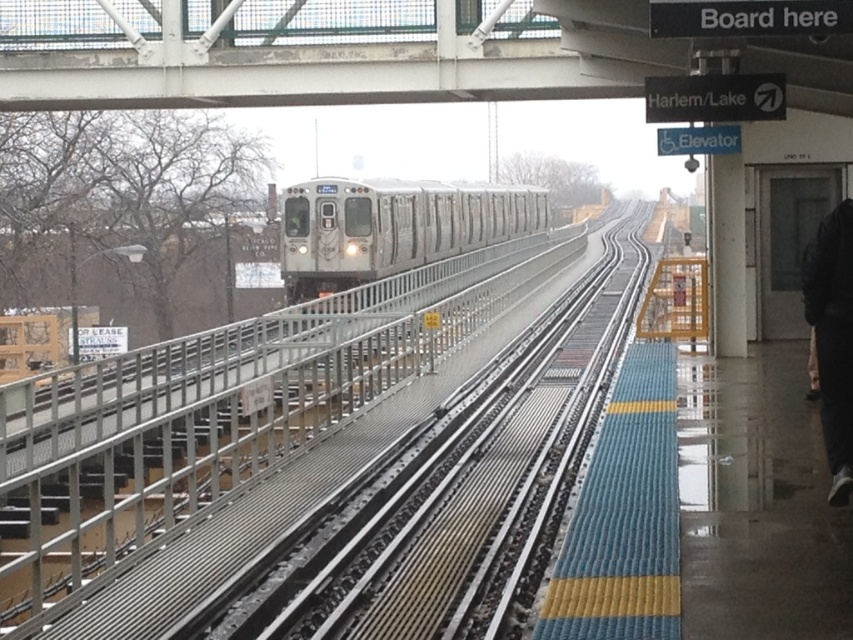
Is metal/smooth rail at center to the right of black fabric pants at lower right from the viewer's perspective?

No, metal/smooth rail at center is not to the right of black fabric pants at lower right.

Can you confirm if metal/smooth rail at center is positioned below black fabric pants at lower right?

No.

Between point (27, 609) and point (845, 460), which one is positioned in front?

Point (845, 460)

Where is `metal/smooth rail at center`? metal/smooth rail at center is located at coordinates (230, 435).

Does silver metallic train at center have a greater width compared to black fabric pants at lower right?

Yes, silver metallic train at center is wider than black fabric pants at lower right.

Can you confirm if silver metallic train at center is positioned to the right of black fabric pants at lower right?

In fact, silver metallic train at center is to the left of black fabric pants at lower right.

Find the location of a particular element. silver metallic train at center is located at coordinates (392, 227).

Can you confirm if metal/smooth rail at center is smaller than white metal bridge at upper center?

Actually, metal/smooth rail at center might be larger than white metal bridge at upper center.

Which is below, metal/smooth rail at center or white metal bridge at upper center?

metal/smooth rail at center is below.

Between point (445, 301) and point (247, 1), which one is positioned in front?

Point (247, 1) is in front.

The height and width of the screenshot is (640, 853). Find the location of `metal/smooth rail at center`. metal/smooth rail at center is located at coordinates (230, 435).